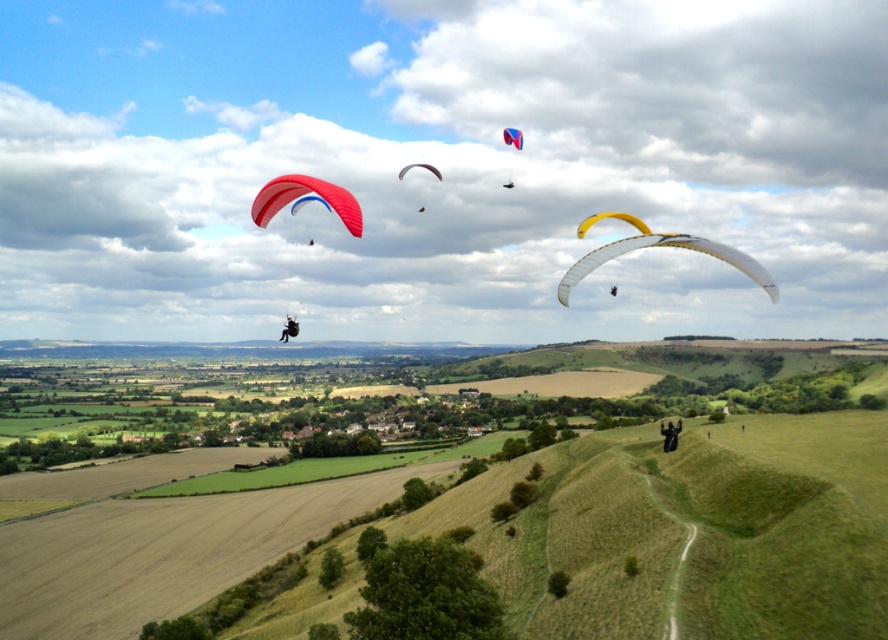
Image resolution: width=888 pixels, height=640 pixels. What do you see at coordinates (657, 244) in the screenshot?
I see `yellow matte paraglider at center` at bounding box center [657, 244].

Can you confirm if yellow matte paraglider at center is taller than matte red paraglider at upper center?

Yes, yellow matte paraglider at center is taller than matte red paraglider at upper center.

Between point (777, 296) and point (278, 177), which one is positioned behind?

The point (278, 177) is more distant.

At what (x,y) coordinates should I click in order to perform the action: click on yellow matte paraglider at center. Please return your answer as a coordinate pair (x, y). The width and height of the screenshot is (888, 640). Looking at the image, I should click on (657, 244).

Measure the distance between matte red paraglider at center-left and camera.

matte red paraglider at center-left is 57.99 meters away from camera.

Which of these two, matte red paraglider at center-left or black fabric parachute at upper center, stands taller?

matte red paraglider at center-left

Looking at this image, who is more distant from viewer, (252, 220) or (286, 323)?

Positioned behind is point (252, 220).

Locate an element on the screen. The width and height of the screenshot is (888, 640). matte red paraglider at center-left is located at coordinates (303, 193).

Can you confirm if black fabric parachute at upper center is positioned to the right of matte red paraglider at center?

Indeed, black fabric parachute at upper center is positioned on the right side of matte red paraglider at center.

Who is more distant from viewer, (289, 326) or (429, 168)?

The point (429, 168) is more distant.

In order to click on black fabric parachute at upper center in this screenshot , I will do `click(289, 328)`.